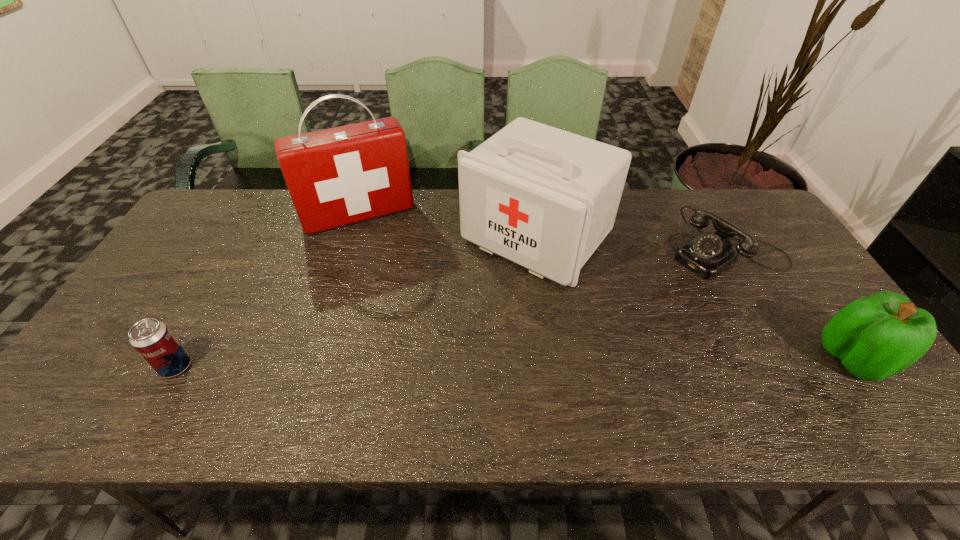
This screenshot has width=960, height=540. I want to click on vacant space that satisfies the following two spatial constraints: 1. on the front side of the second object from left to right; 2. on the right side of the right first-aid kit, so click(352, 237).

Where is `vacant space that satisfies the following two spatial constraints: 1. on the front side of the right first-aid kit; 2. on the left side of the third tallest object`? Image resolution: width=960 pixels, height=540 pixels. vacant space that satisfies the following two spatial constraints: 1. on the front side of the right first-aid kit; 2. on the left side of the third tallest object is located at coordinates (553, 358).